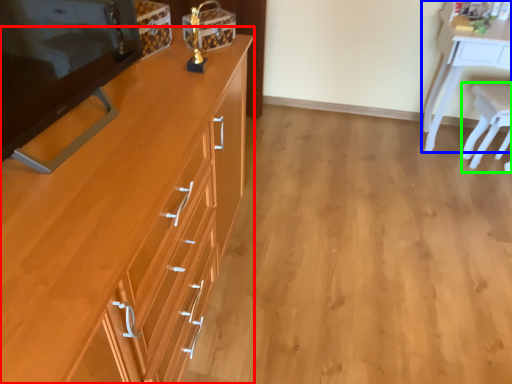
Question: Which object is the farthest from cabinetry (highlighted by a red box)? Choose among these: desk (highlighted by a blue box) or chair (highlighted by a green box).

Choices:
 (A) desk
 (B) chair

Answer: (B)